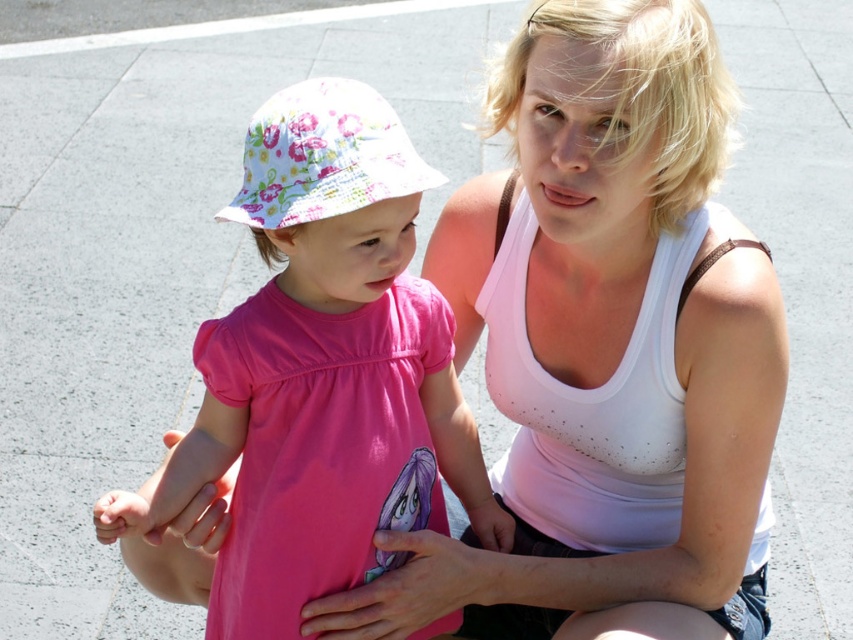
Question: Does pink fabric dress at center have a greater width compared to pink matte dress at center?

Choices:
 (A) yes
 (B) no

Answer: (A)

Question: Considering the relative positions of pink fabric dress at center and pink matte dress at center in the image provided, where is pink fabric dress at center located with respect to pink matte dress at center?

Choices:
 (A) below
 (B) above

Answer: (B)

Question: Estimate the real-world distances between objects in this image. Which object is closer to the white matte tank top at center?

Choices:
 (A) pink matte dress at center
 (B) pink fabric dress at center

Answer: (A)

Question: Among these objects, which one is farthest from the camera?

Choices:
 (A) white matte tank top at center
 (B) pink fabric dress at center
 (C) pink matte dress at center

Answer: (A)

Question: Is pink fabric dress at center to the left of white matte tank top at center from the viewer's perspective?

Choices:
 (A) yes
 (B) no

Answer: (A)

Question: Which of these objects is positioned farthest from the pink fabric dress at center?

Choices:
 (A) pink matte dress at center
 (B) white matte tank top at center

Answer: (B)